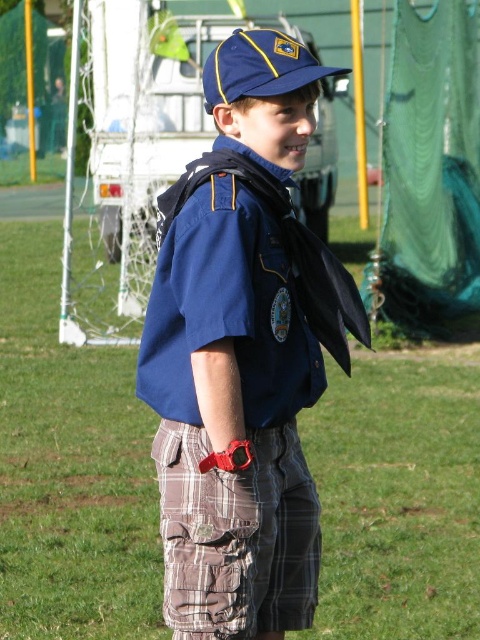
The boy is standing on the green grass at center and wearing brown plaid shorts at center. Which object is positioned to the left of the other?

The green grass at center is to the left of brown plaid shorts at center.

The young boy is standing on the green grass at center and wearing brown plaid shorts at center. Which one is taller?

The green grass at center is much taller than the brown plaid shorts at center.

The blue cotton shirt at center and the brown plaid shorts at center are part of a uniform. If the distance between them is important for a fitting check, can a tailor measure the space between them to ensure proper adjustments?

The blue cotton shirt at center is 6.10 inches away from brown plaid shorts at center, so the tailor can measure the space between them to ensure proper adjustments.